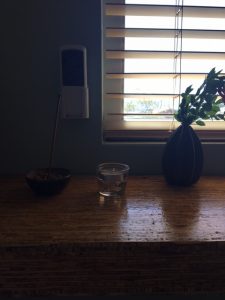
Find the location of a particular element. The height and width of the screenshot is (300, 225). brown table is located at coordinates (142, 208).